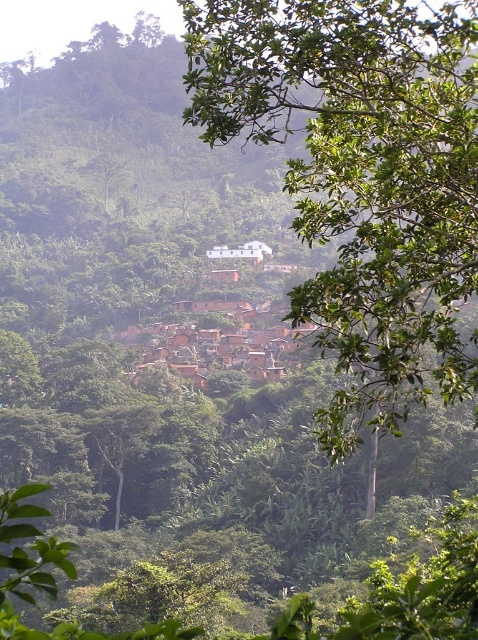
Which is more to the left, green leafy tree at upper center or brown clay houses at center?

brown clay houses at center

Find the location of a particular element. The height and width of the screenshot is (640, 478). green leafy tree at upper center is located at coordinates (361, 177).